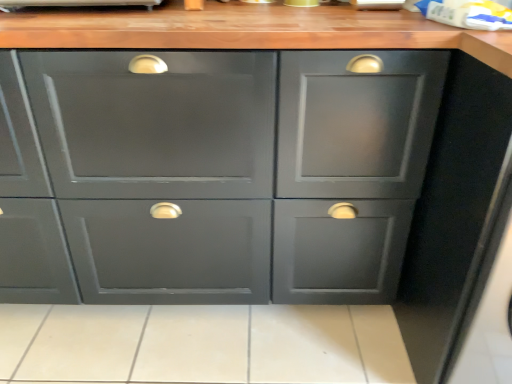
Question: Is matte gray cabinet at center completely or partially outside of beige tile at lower center?

Choices:
 (A) no
 (B) yes

Answer: (B)

Question: From a real-world perspective, is matte gray cabinet at center located beneath beige tile at lower center?

Choices:
 (A) yes
 (B) no

Answer: (B)

Question: Is the position of matte gray cabinet at center less distant than that of beige tile at lower center?

Choices:
 (A) no
 (B) yes

Answer: (B)

Question: Considering the relative sizes of matte gray cabinet at center and beige tile at lower center in the image provided, is matte gray cabinet at center thinner than beige tile at lower center?

Choices:
 (A) no
 (B) yes

Answer: (B)

Question: Would you say matte gray cabinet at center contains beige tile at lower center?

Choices:
 (A) yes
 (B) no

Answer: (B)

Question: Can you confirm if matte gray cabinet at center is bigger than beige tile at lower center?

Choices:
 (A) no
 (B) yes

Answer: (B)

Question: Is the surface of beige tile at lower center in direct contact with matte gray cabinet at center?

Choices:
 (A) yes
 (B) no

Answer: (B)

Question: Is beige tile at lower center closer to the viewer compared to matte gray cabinet at center?

Choices:
 (A) yes
 (B) no

Answer: (B)

Question: Considering the relative positions of beige tile at lower center and matte gray cabinet at center in the image provided, is beige tile at lower center to the right of matte gray cabinet at center from the viewer's perspective?

Choices:
 (A) yes
 (B) no

Answer: (A)

Question: Does beige tile at lower center come behind matte gray cabinet at center?

Choices:
 (A) no
 (B) yes

Answer: (B)

Question: Does beige tile at lower center have a greater height compared to matte gray cabinet at center?

Choices:
 (A) no
 (B) yes

Answer: (A)

Question: Does beige tile at lower center have a larger size compared to matte gray cabinet at center?

Choices:
 (A) no
 (B) yes

Answer: (A)

Question: Considering the positions of point (95, 117) and point (368, 332), is point (95, 117) closer or farther from the camera than point (368, 332)?

Choices:
 (A) farther
 (B) closer

Answer: (B)